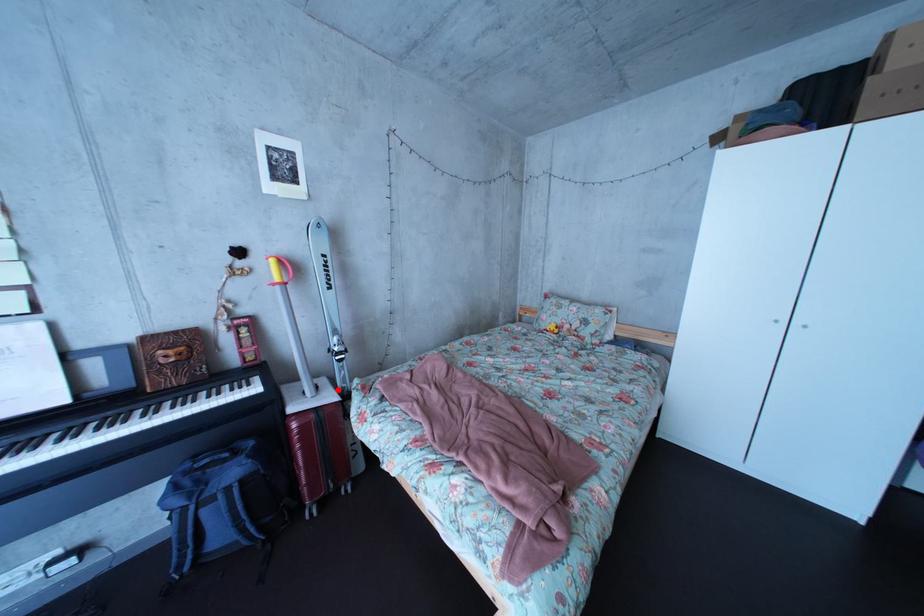
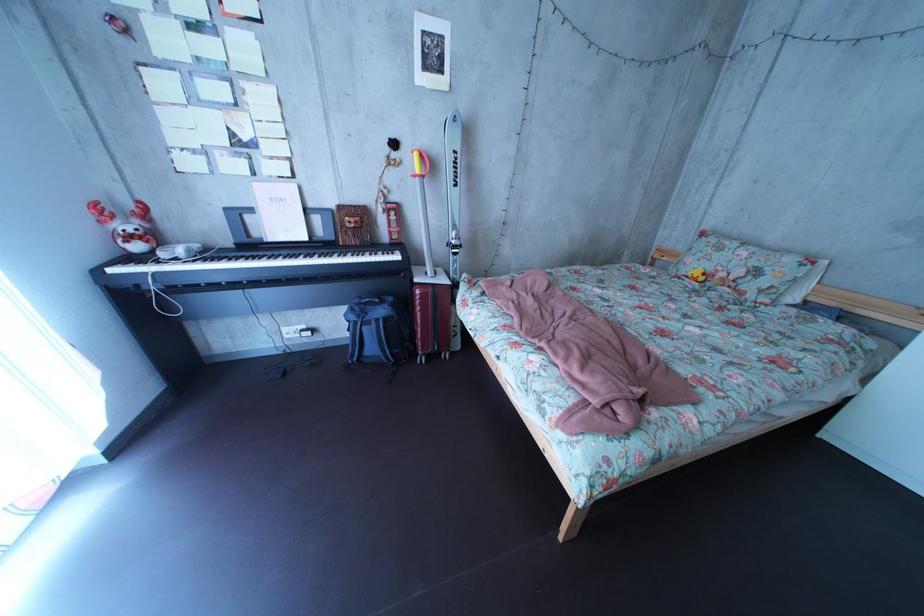
In the second image, find the point that corresponds to the highlighted location in the first image.

(455, 278)